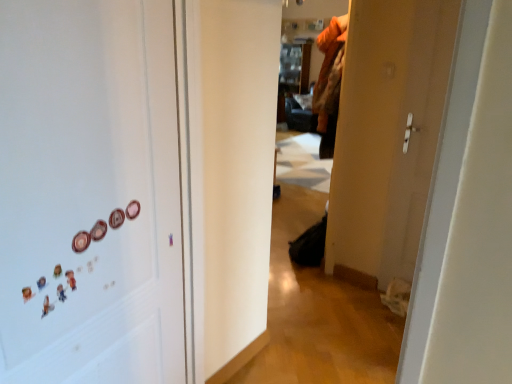
Question: From the image's perspective, is matte plastic button at left, which is the first button in back-to-front order, on top of white matte magnets at left?

Choices:
 (A) no
 (B) yes

Answer: (B)

Question: Can you confirm if matte plastic button at left, which is the second button in left-to-right order, is wider than white matte magnets at left?

Choices:
 (A) yes
 (B) no

Answer: (B)

Question: Considering the relative positions of matte plastic button at left, placed as the 1th button when sorted from right to left, and white matte magnets at left in the image provided, is matte plastic button at left, placed as the 1th button when sorted from right to left, in front of white matte magnets at left?

Choices:
 (A) no
 (B) yes

Answer: (A)

Question: Is matte plastic button at left, which is the first button in back-to-front order, positioned far away from white matte magnets at left?

Choices:
 (A) no
 (B) yes

Answer: (A)

Question: From a real-world perspective, is matte plastic button at left, which is the second button in left-to-right order, beneath white matte magnets at left?

Choices:
 (A) yes
 (B) no

Answer: (B)

Question: From the image's perspective, relative to pink glossy button at left, the 2th button viewed from the back, is white matte magnets at left above or below?

Choices:
 (A) below
 (B) above

Answer: (A)

Question: In the image, is white matte magnets at left positioned in front of or behind pink glossy button at left, the 2th button viewed from the back?

Choices:
 (A) front
 (B) behind

Answer: (A)

Question: From a real-world perspective, is white matte magnets at left physically located above or below pink glossy button at left, the first button when ordered from front to back?

Choices:
 (A) above
 (B) below

Answer: (B)

Question: From their relative heights in the image, would you say white matte magnets at left is taller or shorter than pink glossy button at left, the first button when ordered from front to back?

Choices:
 (A) short
 (B) tall

Answer: (B)

Question: From a real-world perspective, is matte plastic button at left, which is the first button in back-to-front order, above or below white matte magnets at left?

Choices:
 (A) below
 (B) above

Answer: (B)

Question: From the image's perspective, relative to white matte magnets at left, is matte plastic button at left, placed as the 1th button when sorted from right to left, above or below?

Choices:
 (A) above
 (B) below

Answer: (A)

Question: Does point (112, 218) appear closer or farther from the camera than point (14, 14)?

Choices:
 (A) closer
 (B) farther

Answer: (B)

Question: In terms of width, does matte plastic button at left, placed as the 1th button when sorted from right to left, look wider or thinner when compared to white matte magnets at left?

Choices:
 (A) wide
 (B) thin

Answer: (B)

Question: From their relative heights in the image, would you say pink glossy button at left, the 2th button viewed from the back, is taller or shorter than white matte magnets at left?

Choices:
 (A) tall
 (B) short

Answer: (B)

Question: In the image, is pink glossy button at left, which is the 1th button in left-to-right order, positioned in front of or behind white matte magnets at left?

Choices:
 (A) front
 (B) behind

Answer: (B)